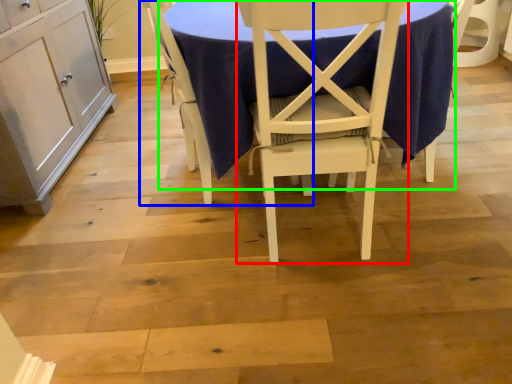
Question: Which object is positioned farthest from chair (highlighted by a red box)? Select from chair (highlighted by a blue box) and table (highlighted by a green box).

Choices:
 (A) chair
 (B) table

Answer: (A)